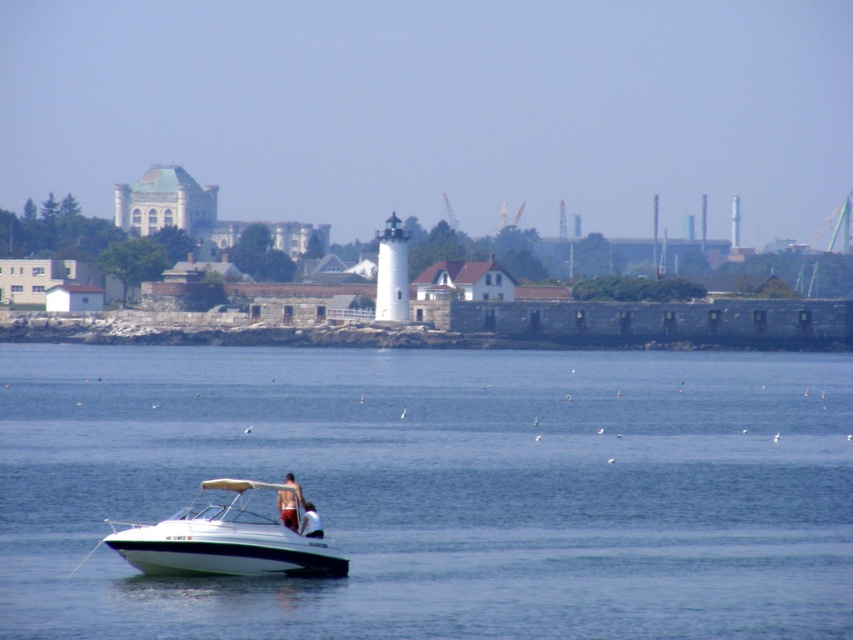
The image size is (853, 640). Describe the element at coordinates (438, 490) in the screenshot. I see `blue water at center` at that location.

Does blue water at center appear over tan skin human at lower center?

Yes.

Image resolution: width=853 pixels, height=640 pixels. What do you see at coordinates (438, 490) in the screenshot?
I see `blue water at center` at bounding box center [438, 490].

The width and height of the screenshot is (853, 640). What are the coordinates of `blue water at center` in the screenshot? It's located at (438, 490).

Image resolution: width=853 pixels, height=640 pixels. In order to click on tan skin human at lower center in this screenshot , I will do `click(289, 502)`.

Can you confirm if tan skin human at lower center is positioned above skinny jeans at lower center?

Yes.

Does point (291, 515) come closer to viewer compared to point (318, 532)?

Yes, it is in front of point (318, 532).

Locate an element on the screen. tan skin human at lower center is located at coordinates (289, 502).

Between blue water at center and skinny jeans at lower center, which one appears on the left side from the viewer's perspective?

blue water at center

Find the location of a particular element. The width and height of the screenshot is (853, 640). blue water at center is located at coordinates (438, 490).